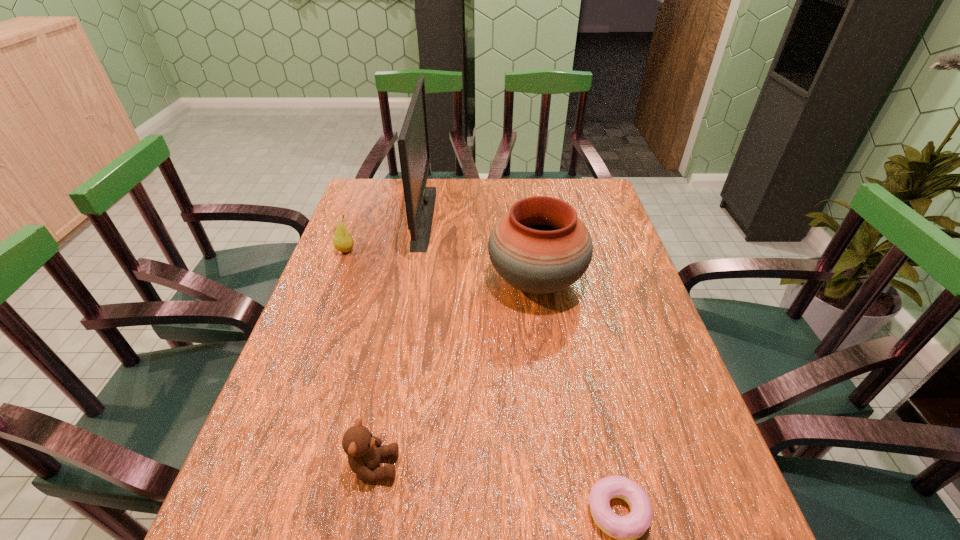
This screenshot has width=960, height=540. Find the location of `monitor`. monitor is located at coordinates (413, 142).

The image size is (960, 540). What are the coordinates of `the fourth shortest object` in the screenshot? It's located at (540, 246).

The height and width of the screenshot is (540, 960). I want to click on pear, so point(342,241).

The width and height of the screenshot is (960, 540). What are the coordinates of `teddy bear` in the screenshot? It's located at (364, 451).

Locate an element on the screen. vacant area situated on the front-facing side of the tallest object is located at coordinates (455, 217).

Where is `free region located 0.190m on the front of the second tallest object`? This screenshot has height=540, width=960. free region located 0.190m on the front of the second tallest object is located at coordinates tap(550, 380).

In order to click on vacant space located on the front of the leftmost object in this screenshot , I will do `click(332, 287)`.

The image size is (960, 540). Find the location of `free location located on the face of the teddy bear`. free location located on the face of the teddy bear is located at coordinates (457, 467).

The height and width of the screenshot is (540, 960). I want to click on object situated at the far edge, so click(413, 142).

This screenshot has height=540, width=960. I want to click on object located at the left edge, so click(x=342, y=241).